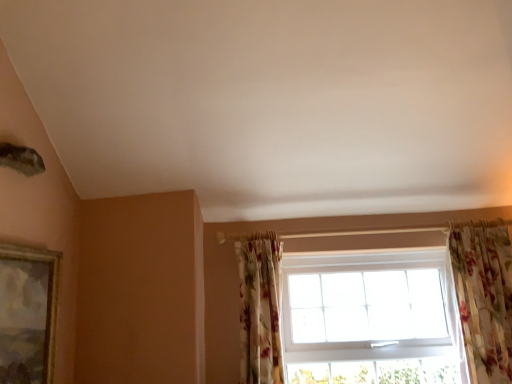
Question: Based on their sizes in the image, would you say floral fabric curtain at lower right, marked as the 2th curtain in a right-to-left arrangement, is bigger or smaller than white plastic window at center?

Choices:
 (A) small
 (B) big

Answer: (A)

Question: Is floral fabric curtain at lower right, which is counted as the first curtain, starting from the left, situated inside white plastic window at center or outside?

Choices:
 (A) inside
 (B) outside

Answer: (B)

Question: Estimate the real-world distances between objects in this image. Which object is farther from the floral fabric curtain at lower right, which is counted as the first curtain, starting from the left?

Choices:
 (A) white plastic window at center
 (B) floral fabric curtain at right, acting as the second curtain starting from the left
 (C) gold-framed painting at left

Answer: (B)

Question: Estimate the real-world distances between objects in this image. Which object is farther from the white plastic window at center?

Choices:
 (A) floral fabric curtain at right, the 1th curtain in the right-to-left sequence
 (B) floral fabric curtain at lower right, which is counted as the first curtain, starting from the left
 (C) gold-framed painting at left

Answer: (C)